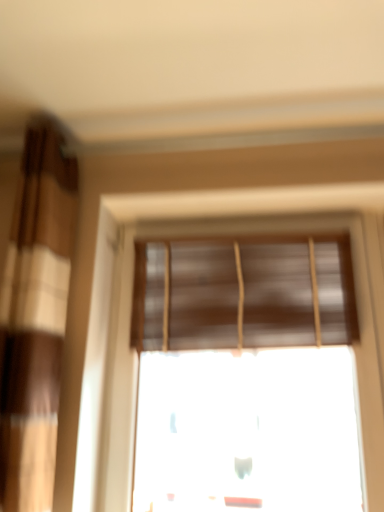
Question: Does brown textured curtain at left lie behind brown matte blinds at center?

Choices:
 (A) no
 (B) yes

Answer: (A)

Question: Is brown textured curtain at left outside brown matte blinds at center?

Choices:
 (A) no
 (B) yes

Answer: (B)

Question: Does brown textured curtain at left have a lesser height compared to brown matte blinds at center?

Choices:
 (A) yes
 (B) no

Answer: (B)

Question: Are brown textured curtain at left and brown matte blinds at center located far from each other?

Choices:
 (A) no
 (B) yes

Answer: (A)

Question: Is brown textured curtain at left bigger than brown matte blinds at center?

Choices:
 (A) no
 (B) yes

Answer: (B)

Question: In the image, is brown matte window blind at upper center positioned in front of or behind brown textured curtain at left?

Choices:
 (A) front
 (B) behind

Answer: (B)

Question: In terms of size, does brown matte window blind at upper center appear bigger or smaller than brown textured curtain at left?

Choices:
 (A) small
 (B) big

Answer: (A)

Question: From a real-world perspective, relative to brown textured curtain at left, is brown matte window blind at upper center vertically above or below?

Choices:
 (A) above
 (B) below

Answer: (A)

Question: From the image's perspective, relative to brown textured curtain at left, is brown matte window blind at upper center above or below?

Choices:
 (A) above
 (B) below

Answer: (B)

Question: Relative to brown textured curtain at left, is brown matte blinds at center in front or behind?

Choices:
 (A) front
 (B) behind

Answer: (B)

Question: From their relative heights in the image, would you say brown matte blinds at center is taller or shorter than brown textured curtain at left?

Choices:
 (A) tall
 (B) short

Answer: (B)

Question: Would you say brown matte blinds at center is inside or outside brown textured curtain at left?

Choices:
 (A) inside
 (B) outside

Answer: (B)

Question: In terms of size, does brown matte blinds at center appear bigger or smaller than brown textured curtain at left?

Choices:
 (A) small
 (B) big

Answer: (A)

Question: Considering the positions of point (0, 431) and point (208, 378), is point (0, 431) closer or farther from the camera than point (208, 378)?

Choices:
 (A) farther
 (B) closer

Answer: (B)

Question: Considering the positions of brown textured curtain at left and brown matte blinds at center in the image, is brown textured curtain at left wider or thinner than brown matte blinds at center?

Choices:
 (A) thin
 (B) wide

Answer: (B)